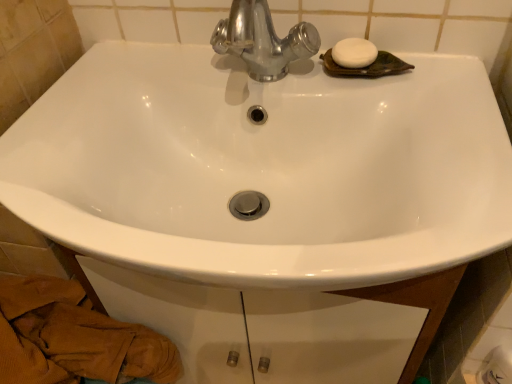
Question: From a real-world perspective, is white matte soap at upper right positioned over white glossy toilet paper at lower right based on gravity?

Choices:
 (A) no
 (B) yes

Answer: (B)

Question: Is white matte soap at upper right wider than white glossy toilet paper at lower right?

Choices:
 (A) no
 (B) yes

Answer: (B)

Question: Can you confirm if white matte soap at upper right is positioned to the left of white glossy toilet paper at lower right?

Choices:
 (A) no
 (B) yes

Answer: (B)

Question: From a real-world perspective, is white matte soap at upper right below white glossy toilet paper at lower right?

Choices:
 (A) no
 (B) yes

Answer: (A)

Question: Is white matte soap at upper right shorter than white glossy toilet paper at lower right?

Choices:
 (A) yes
 (B) no

Answer: (A)

Question: Does point (166, 357) appear closer or farther from the camera than point (481, 370)?

Choices:
 (A) closer
 (B) farther

Answer: (B)

Question: Do you think brown textured towel at lower left is within white glossy toilet paper at lower right, or outside of it?

Choices:
 (A) outside
 (B) inside

Answer: (A)

Question: From a real-world perspective, is brown textured towel at lower left positioned above or below white glossy toilet paper at lower right?

Choices:
 (A) below
 (B) above

Answer: (A)

Question: Is brown textured towel at lower left in front of or behind white glossy toilet paper at lower right in the image?

Choices:
 (A) front
 (B) behind

Answer: (A)

Question: Would you say brown textured towel at lower left is inside or outside white matte soap at upper right?

Choices:
 (A) inside
 (B) outside

Answer: (B)

Question: Relative to white matte soap at upper right, is brown textured towel at lower left in front or behind?

Choices:
 (A) front
 (B) behind

Answer: (A)

Question: Considering the positions of point (104, 370) and point (332, 59), is point (104, 370) closer or farther from the camera than point (332, 59)?

Choices:
 (A) closer
 (B) farther

Answer: (B)

Question: From their relative heights in the image, would you say brown textured towel at lower left is taller or shorter than white matte soap at upper right?

Choices:
 (A) tall
 (B) short

Answer: (A)

Question: Looking at their shapes, would you say white glossy toilet paper at lower right is wider or thinner than brown textured towel at lower left?

Choices:
 (A) wide
 (B) thin

Answer: (B)

Question: Would you say white glossy toilet paper at lower right is to the left or to the right of brown textured towel at lower left in the picture?

Choices:
 (A) right
 (B) left

Answer: (A)